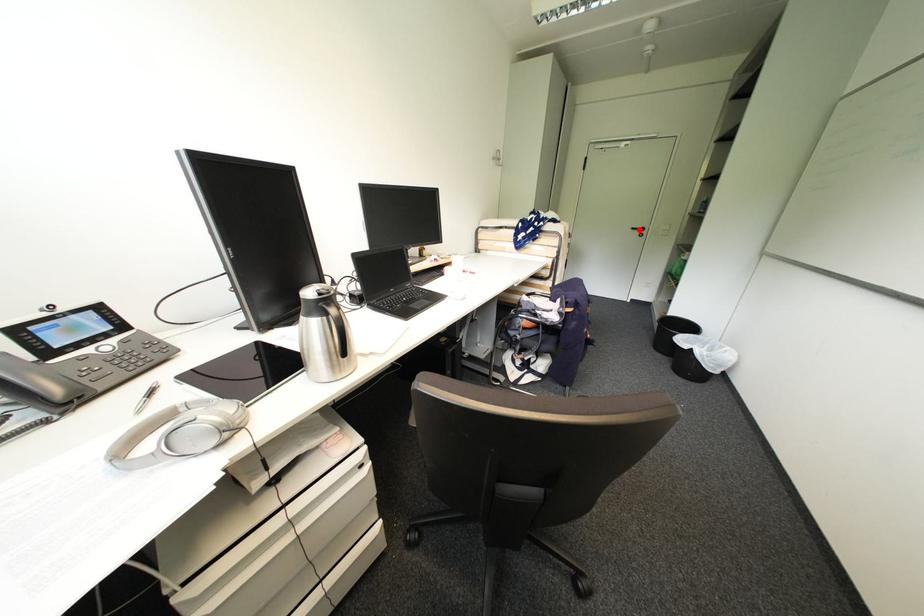
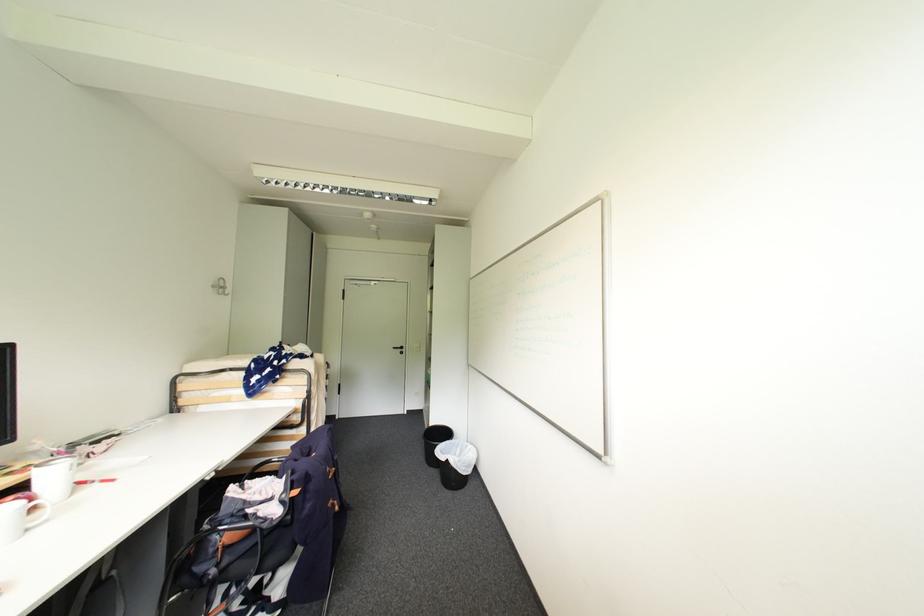
Question: I am providing you with two images of the same scene from different viewpoints. In image1, a red point is highlighted. Considering the same 3D point in image2, which of the following is correct?

Choices:
 (A) It is closer
 (B) It is farther

Answer: (B)